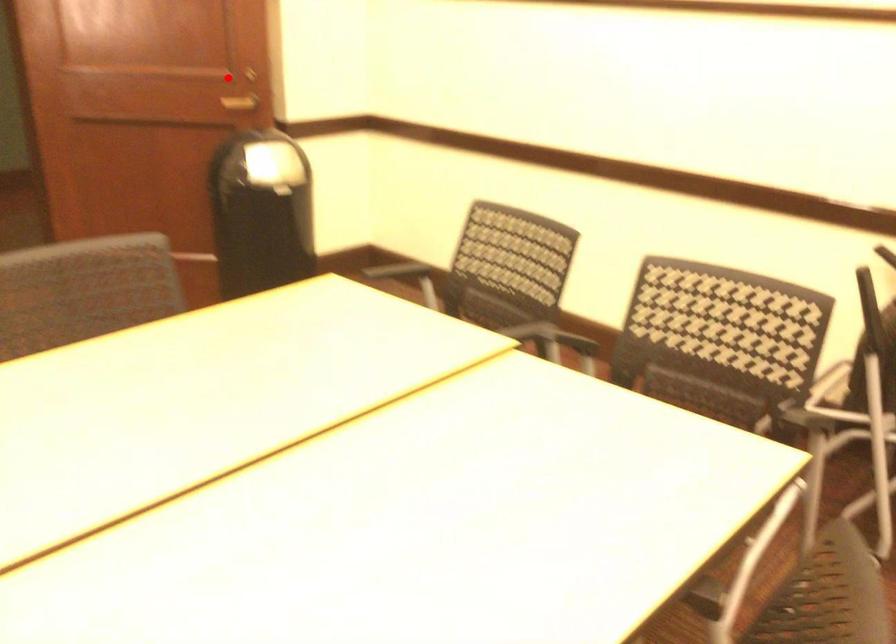
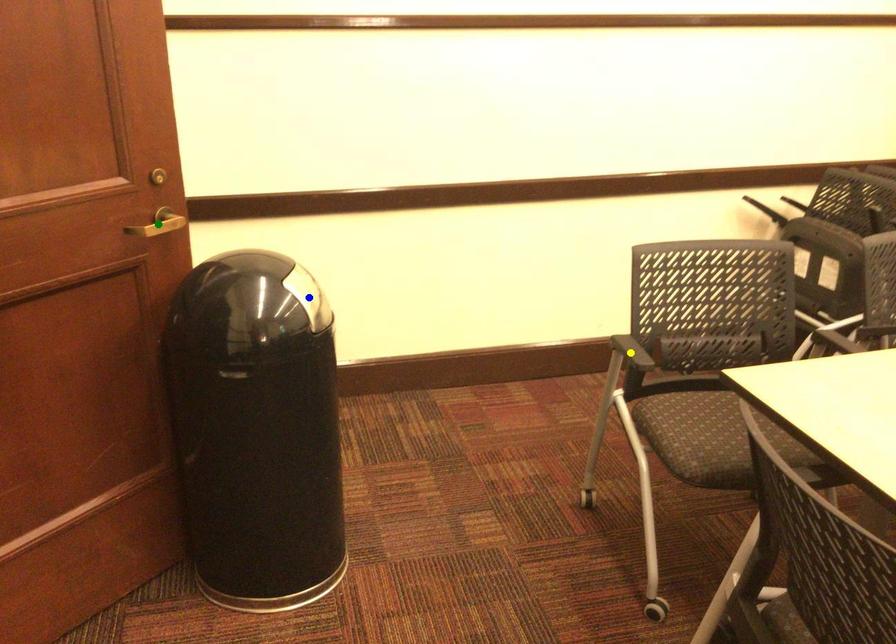
Question: I am providing you with two images of the same scene from different viewpoints. A red point is marked on the first image. You are given multiple points on the second image. Which point in image 2 represents the same 3d spot as the red point in image 1?

Choices:
 (A) green point
 (B) blue point
 (C) yellow point

Answer: (A)